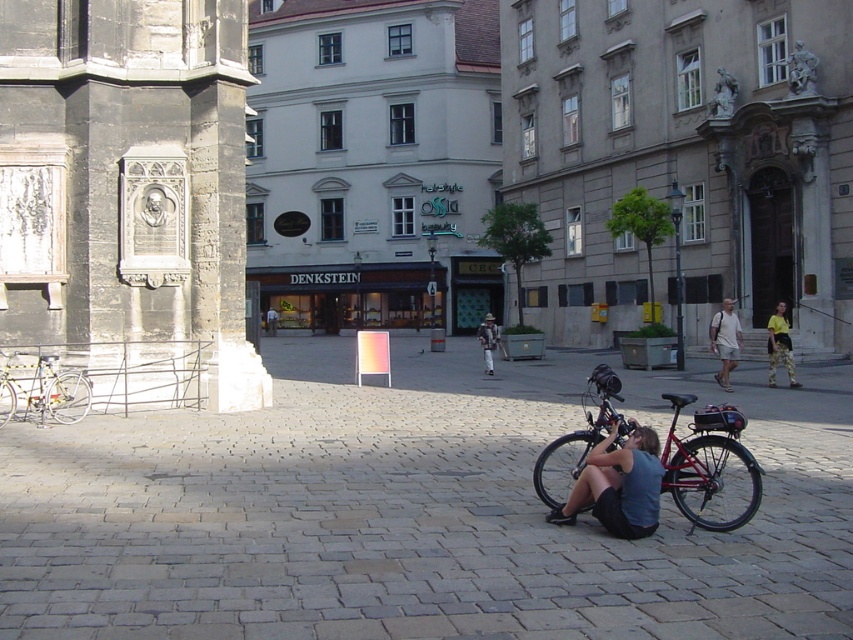
You are a tourist standing in the plaza and want to take a photo of the shiny red bicycle at lower right without the light brown shorts at center blocking the view. Is there a way to do this?

The shiny red bicycle at lower right is positioned under the light brown shorts at center, so moving to the side might allow you to take a photo without the shorts blocking the view.

You are a delivery person who needs to choose between the shiny red bicycle at lower right and the silver metallic bicycle at left. Which bicycle is bigger?

The shiny red bicycle at lower right is larger in size than the silver metallic bicycle at left, so the shiny red bicycle at lower right is bigger.